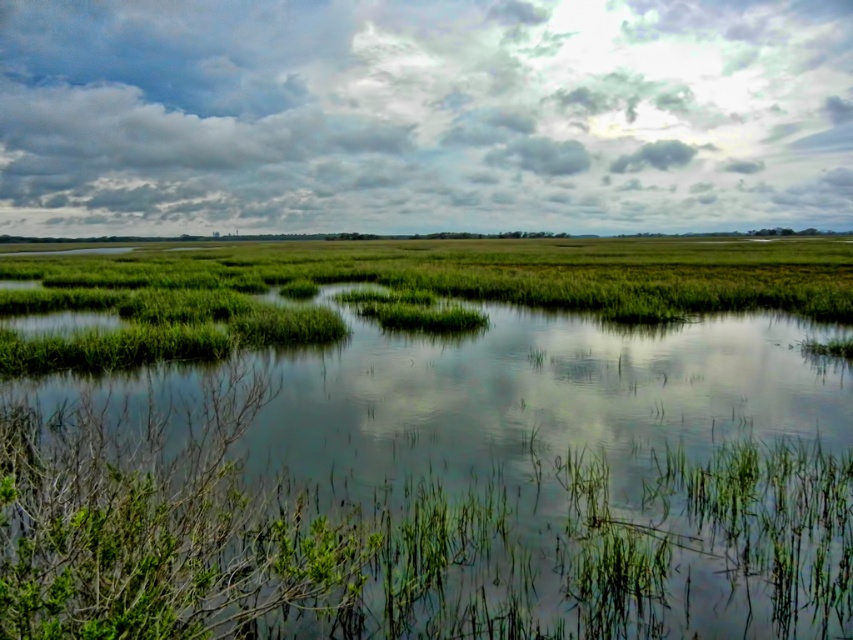
You are standing at the edge of the wetland and looking towards the cloudy sky at upper center and the green grassy water at center. Which object is higher in the scene?

The cloudy sky at upper center is taller than the green grassy water at center.

You are standing at the edge of the wetland and looking towards the center. Which object is positioned to the left of the other between the cloudy sky at upper center and the green grassy water at center?

The cloudy sky at upper center is positioned to the left of the green grassy water at center.